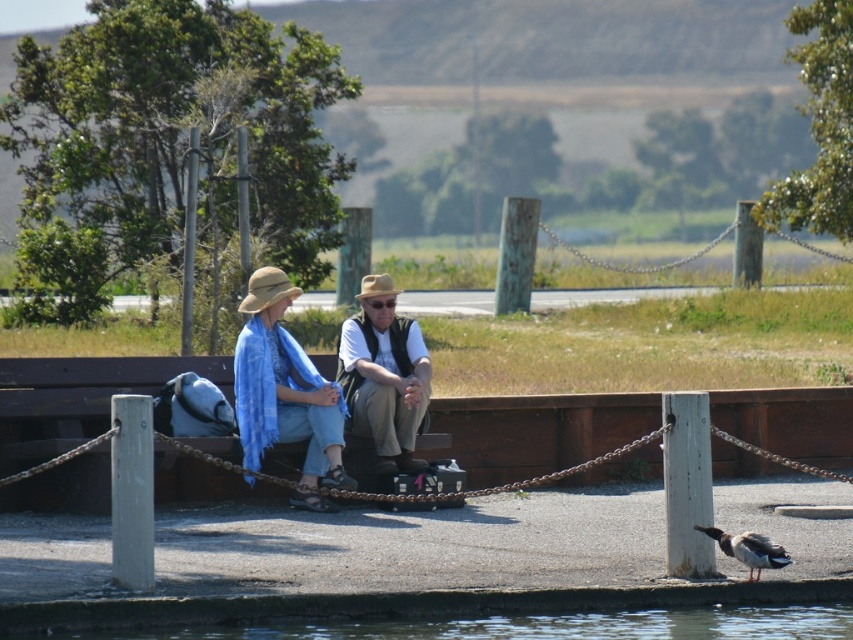
Which is below, wooden park bench at center or beige straw hat at center?

wooden park bench at center

Can you confirm if wooden park bench at center is shorter than beige straw hat at center?

In fact, wooden park bench at center may be taller than beige straw hat at center.

Is point (4, 435) positioned after point (239, 305)?

No, it is not.

What are the coordinates of `wooden park bench at center` in the screenshot? It's located at (78, 397).

Can you confirm if matte white shirt at center is smaller than beige straw hat at center?

Incorrect, matte white shirt at center is not smaller in size than beige straw hat at center.

Does matte white shirt at center appear under beige straw hat at center?

Indeed, matte white shirt at center is positioned under beige straw hat at center.

Where is `matte white shirt at center`? This screenshot has height=640, width=853. matte white shirt at center is located at coordinates (285, 394).

Where is `matte white shirt at center`? The image size is (853, 640). matte white shirt at center is located at coordinates (285, 394).

Is point (720, 620) positioned after point (323, 390)?

That is False.

Where is `clear water at lower center`? This screenshot has height=640, width=853. clear water at lower center is located at coordinates (508, 625).